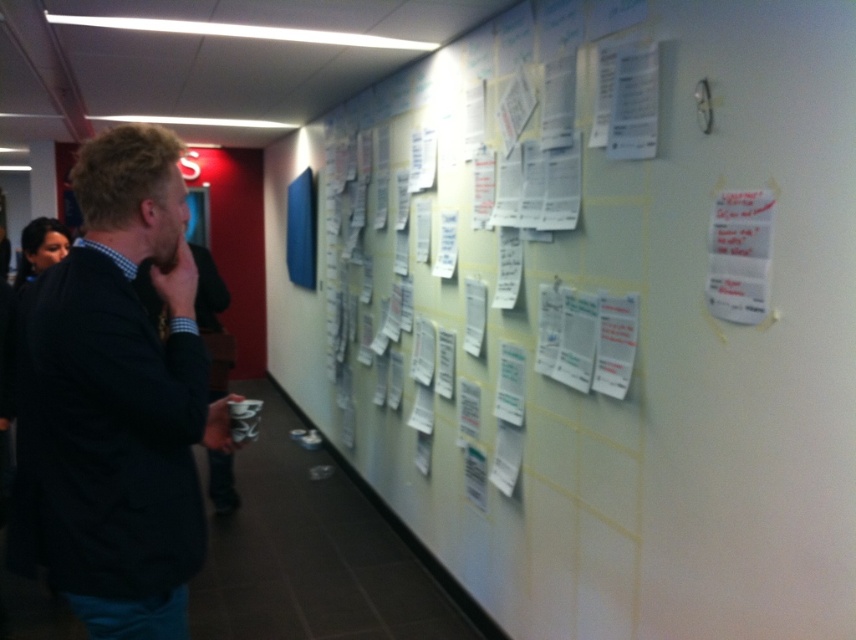
Question: Can you confirm if white paper at upper center is bigger than dark blue sweater at left?

Choices:
 (A) yes
 (B) no

Answer: (A)

Question: Which of the following is the closest to the observer?

Choices:
 (A) (473, 428)
 (B) (90, 324)

Answer: (B)

Question: Which point appears closest to the camera in this image?

Choices:
 (A) (435, 346)
 (B) (82, 396)

Answer: (B)

Question: In this image, where is white paper at upper center located relative to dark blue sweater at left?

Choices:
 (A) right
 (B) left

Answer: (A)

Question: Is white paper at upper center positioned in front of dark blue sweater at left?

Choices:
 (A) yes
 (B) no

Answer: (B)